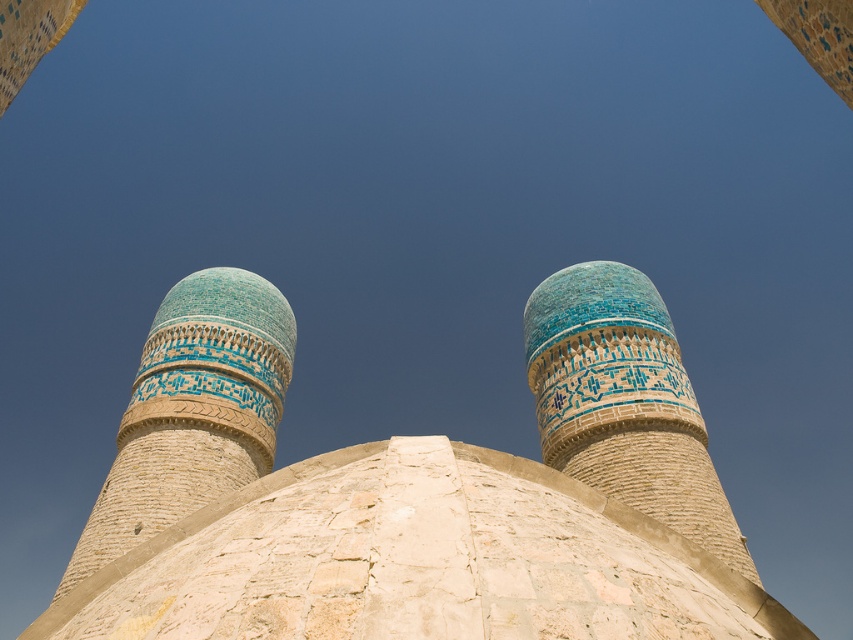
Question: Which point is farther from the camera taking this photo?

Choices:
 (A) (219, 442)
 (B) (585, 420)

Answer: (A)

Question: Considering the relative positions of turquoise mosaic dome at center and blue glazed brick minaret at center in the image provided, where is turquoise mosaic dome at center located with respect to blue glazed brick minaret at center?

Choices:
 (A) right
 (B) left

Answer: (A)

Question: Is turquoise mosaic dome at center above blue glazed brick minaret at center?

Choices:
 (A) no
 (B) yes

Answer: (B)

Question: Is turquoise mosaic dome at center closer to the viewer compared to blue glazed brick minaret at center?

Choices:
 (A) yes
 (B) no

Answer: (A)

Question: Which of the following is the farthest from the observer?

Choices:
 (A) turquoise mosaic dome at center
 (B) blue glazed brick minaret at center

Answer: (B)

Question: Which point is farther to the camera?

Choices:
 (A) (606, 392)
 (B) (231, 305)

Answer: (B)